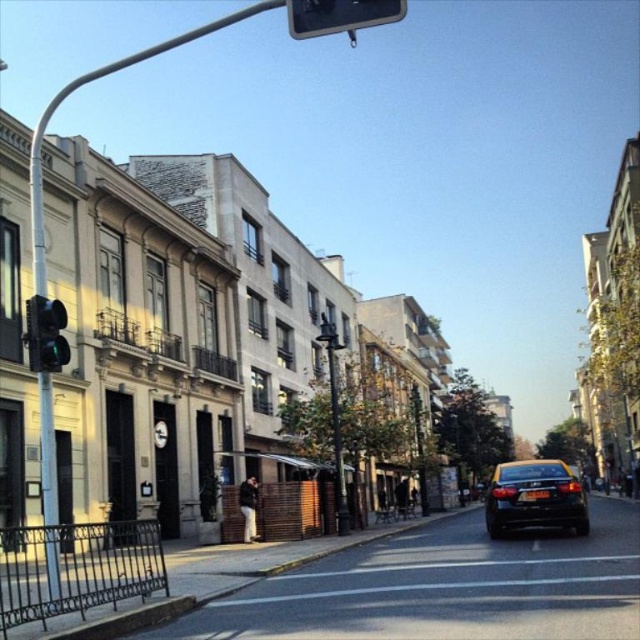
Can you confirm if black glossy car at center is thinner than green glass traffic light at left?

No.

Which is above, black glossy car at center or green glass traffic light at left?

green glass traffic light at left is higher up.

Image resolution: width=640 pixels, height=640 pixels. In order to click on black glossy car at center in this screenshot , I will do `click(534, 497)`.

At what (x,y) coordinates should I click in order to perform the action: click on black glossy car at center. Please return your answer as a coordinate pair (x, y). This screenshot has width=640, height=640. Looking at the image, I should click on (x=534, y=497).

Does point (529, 518) come closer to viewer compared to point (400, 10)?

No, it is behind (400, 10).

This screenshot has width=640, height=640. Describe the element at coordinates (534, 497) in the screenshot. I see `black glossy car at center` at that location.

You are a GUI agent. You are given a task and a screenshot of the screen. Output one action in this format:
    pyautogui.click(x=<x>, y=<y>)
    Task: Click on the black glossy car at center
    
    Given the screenshot: What is the action you would take?
    pyautogui.click(x=534, y=497)

Is metallic rectangular sign at upper center shorter than green glass traffic light at left?

In fact, metallic rectangular sign at upper center may be taller than green glass traffic light at left.

Describe the element at coordinates (340, 16) in the screenshot. I see `metallic rectangular sign at upper center` at that location.

Which is behind, point (369, 20) or point (58, 324)?

The point (58, 324) is more distant.

You are a GUI agent. You are given a task and a screenshot of the screen. Output one action in this format:
    pyautogui.click(x=<x>, y=<y>)
    Task: Click on the metallic rectangular sign at upper center
    This screenshot has height=640, width=640.
    Given the screenshot: What is the action you would take?
    [340, 16]